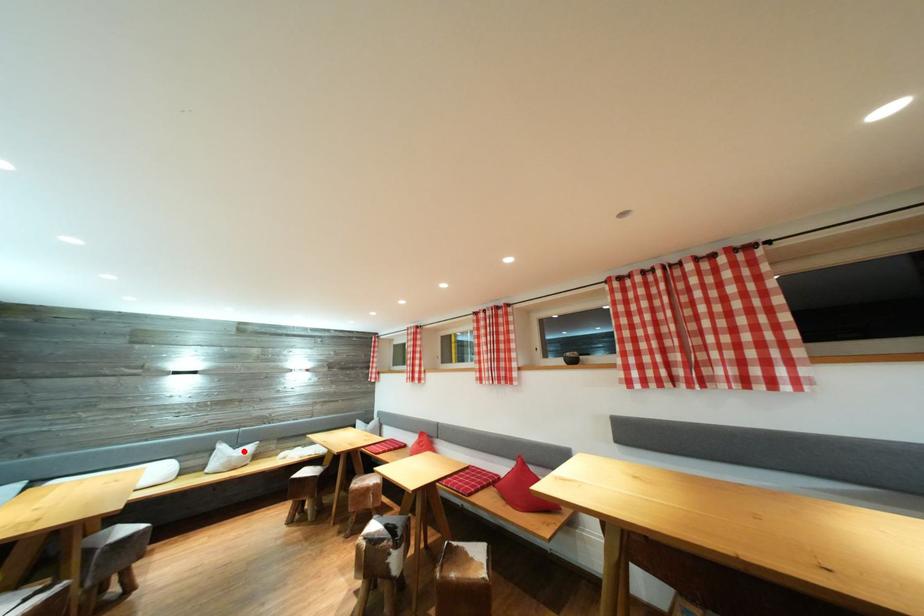
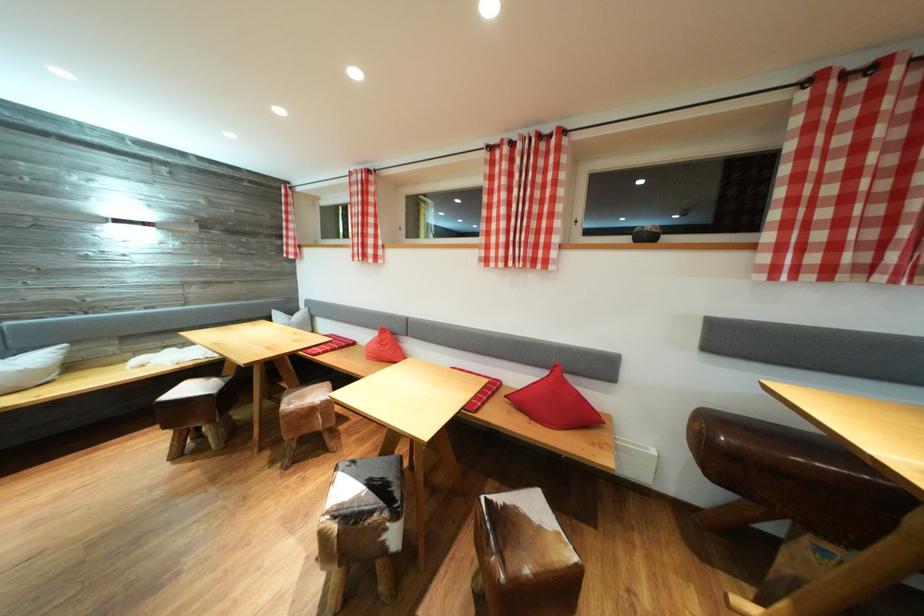
Find the pixel in the second image that matches the highlighted location in the first image.

(14, 358)